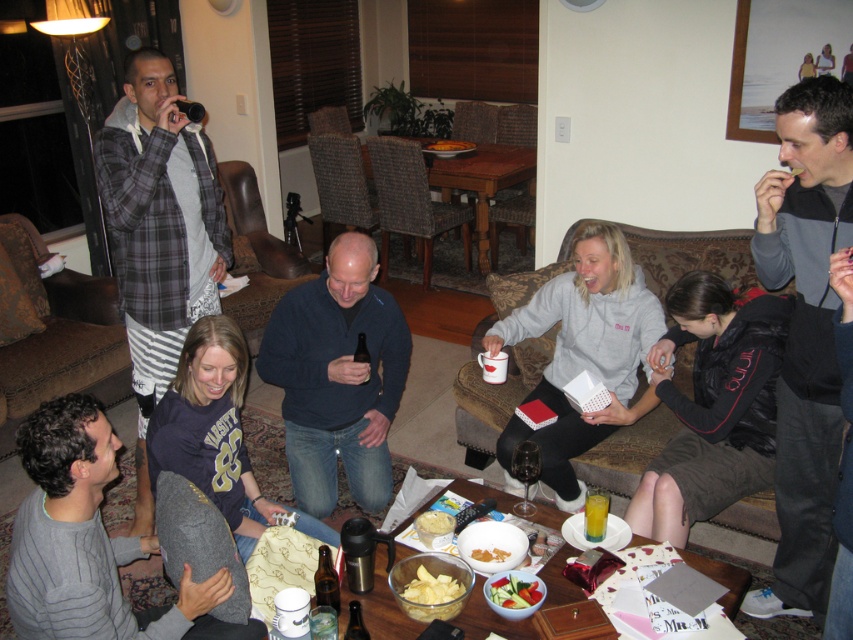
You are standing at the entrance of the living room and see two points marked in the image. The first point is at coordinates point (94,576) and the second point is at point (437,515). If you want to reach the point that is closer to you, which coordinate should you head towards?

The point at coordinates point (94,576) is in front of point (437,515), so you should head towards point (94,576) to reach the closer one.